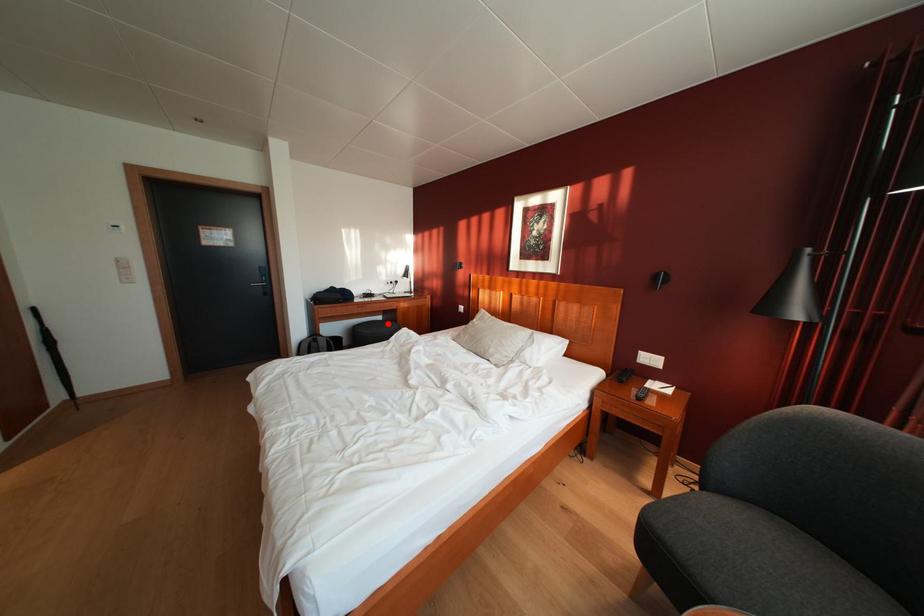
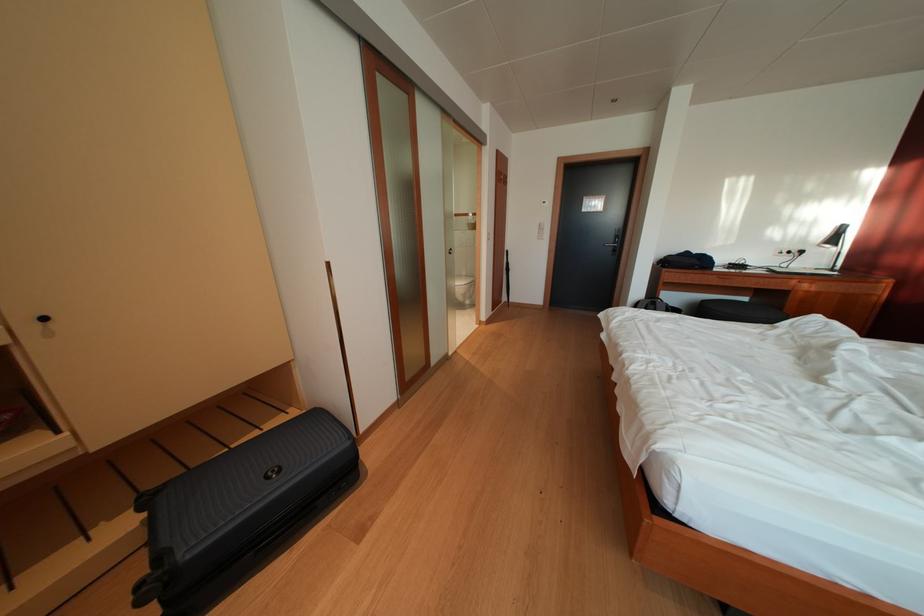
Find the pixel in the second image that matches the highlighted location in the first image.

(752, 305)